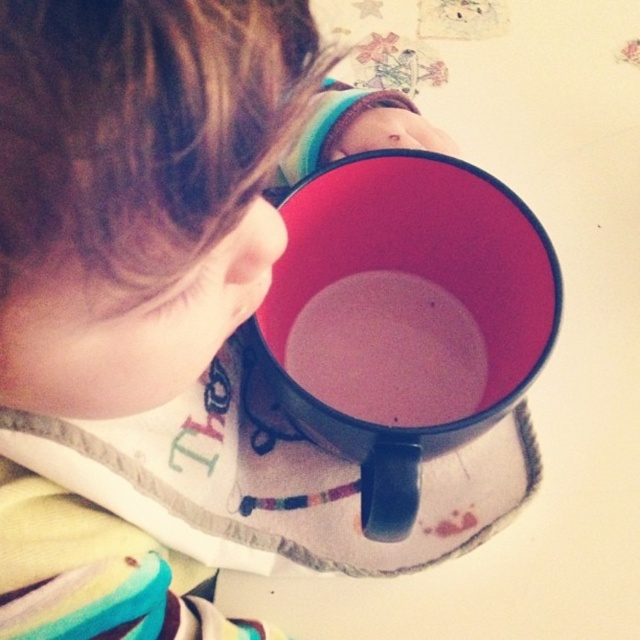
In the scene shown: Can you confirm if matte black cup at upper center is bigger than matte black mug at center?

Correct, matte black cup at upper center is larger in size than matte black mug at center.

This screenshot has width=640, height=640. Describe the element at coordinates (138, 188) in the screenshot. I see `matte black cup at upper center` at that location.

Is point (48, 554) less distant than point (481, 260)?

Yes, it is in front of point (481, 260).

Where is `matte black cup at upper center`? matte black cup at upper center is located at coordinates (138, 188).